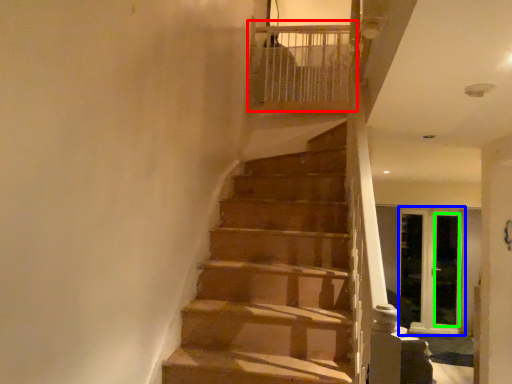
Question: Based on their relative distances, which object is nearer to balustrade (highlighted by a red box)? Choose from screen door (highlighted by a blue box) and screen door (highlighted by a green box).

Choices:
 (A) screen door
 (B) screen door

Answer: (A)